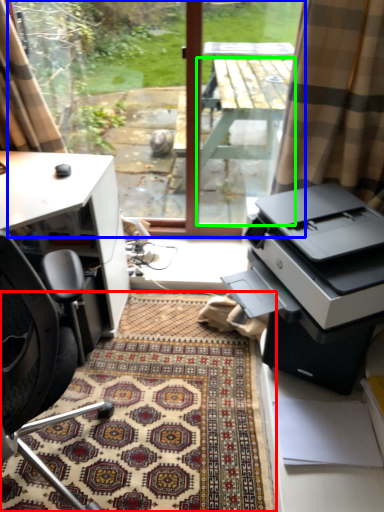
Question: Based on their relative distances, which object is nearer to doormat (highlighted by a red box)? Choose from window screen (highlighted by a blue box) and table (highlighted by a green box).

Choices:
 (A) window screen
 (B) table

Answer: (A)